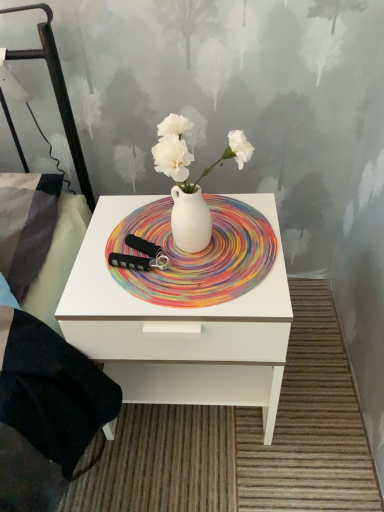
This screenshot has width=384, height=512. I want to click on blank space situated above white glossy nightstand at center (from a real-world perspective), so click(168, 249).